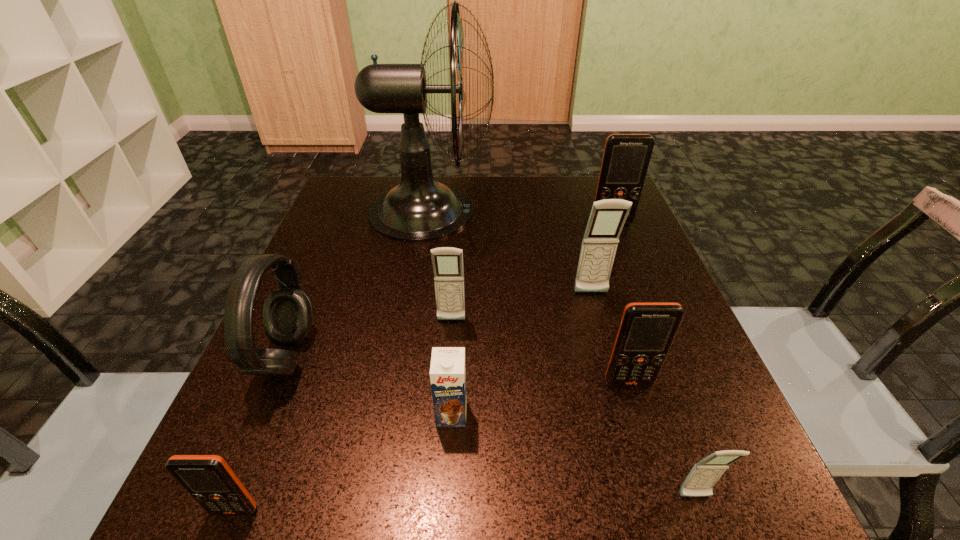
You are a GUI agent. You are given a task and a screenshot of the screen. Output one action in this format:
    pyautogui.click(x=<x>, y=<y>)
    Task: Click on the chocolate milk
    
    Given the screenshot: What is the action you would take?
    pyautogui.click(x=447, y=370)

Identify the location of the leftmost cellular telephone. Image resolution: width=960 pixels, height=540 pixels. (208, 479).

Identify the location of the smallest orange cellular telephone. click(x=208, y=479).

The width and height of the screenshot is (960, 540). I want to click on the nearest gray cellular telephone, so click(700, 481).

This screenshot has height=540, width=960. I want to click on the smallest gray cellular telephone, so click(x=700, y=481).

In order to click on vacant space located 0.150m on the front-facing side of the tallest object in this screenshot , I will do `click(550, 211)`.

The width and height of the screenshot is (960, 540). What are the coordinates of `vacant space located 0.220m on the front-facing side of the second gray cellular telephone from right to left` in the screenshot? It's located at (619, 393).

At what (x,y) coordinates should I click in order to perform the action: click on free location located on the screen of the farthest orange cellular telephone. Please return your answer as a coordinate pair (x, y). This screenshot has height=540, width=960. Looking at the image, I should click on (665, 357).

You are a GUI agent. You are given a task and a screenshot of the screen. Output one action in this format:
    pyautogui.click(x=<x>, y=<y>)
    Task: Click on the vacant region located 0.330m on the earcups of the gray headset
    
    Given the screenshot: What is the action you would take?
    click(x=499, y=356)

Where is `free space located on the front-facing side of the leftmost gray cellular telephone`? free space located on the front-facing side of the leftmost gray cellular telephone is located at coordinates click(443, 454).